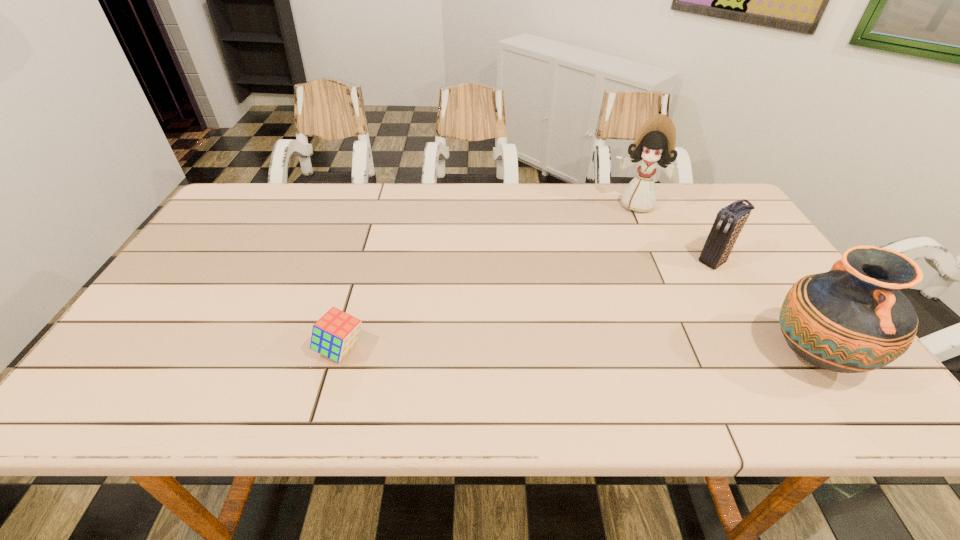
You are a GUI agent. You are given a task and a screenshot of the screen. Output one action in this format:
    pyautogui.click(x=<x>, y=<y>)
    Task: Click on the object that is at the near right corner
    The width and height of the screenshot is (960, 540).
    Given the screenshot: What is the action you would take?
    pyautogui.click(x=852, y=319)

You are a GUI agent. You are given a task and a screenshot of the screen. Output one action in this format:
    pyautogui.click(x=<x>, y=<y>)
    Task: Click on the free space at the far edge of the desktop
    The height and width of the screenshot is (540, 960).
    Given the screenshot: What is the action you would take?
    (x=318, y=215)

Find the location of a particular element. This screenshot has height=540, width=960. free space at the near edge of the desktop is located at coordinates (473, 355).

In the image, there is a desktop. Where is `vacant space at the right edge`? Image resolution: width=960 pixels, height=540 pixels. vacant space at the right edge is located at coordinates [702, 227].

I want to click on blank region between the second shortest object and the cube, so [528, 305].

This screenshot has width=960, height=540. I want to click on empty location between the pottery and the farthest object, so click(725, 280).

The width and height of the screenshot is (960, 540). In order to click on free space between the third object from right to left and the third tallest object in this screenshot , I will do `click(676, 233)`.

Where is `vacant area between the shortest object and the pottery`? Image resolution: width=960 pixels, height=540 pixels. vacant area between the shortest object and the pottery is located at coordinates (577, 353).

Find the location of a particular element. empty location between the third object from right to left and the third tallest object is located at coordinates (676, 233).

Where is `empty space that is in between the third tallest object and the shortest object`? The height and width of the screenshot is (540, 960). empty space that is in between the third tallest object and the shortest object is located at coordinates (528, 305).